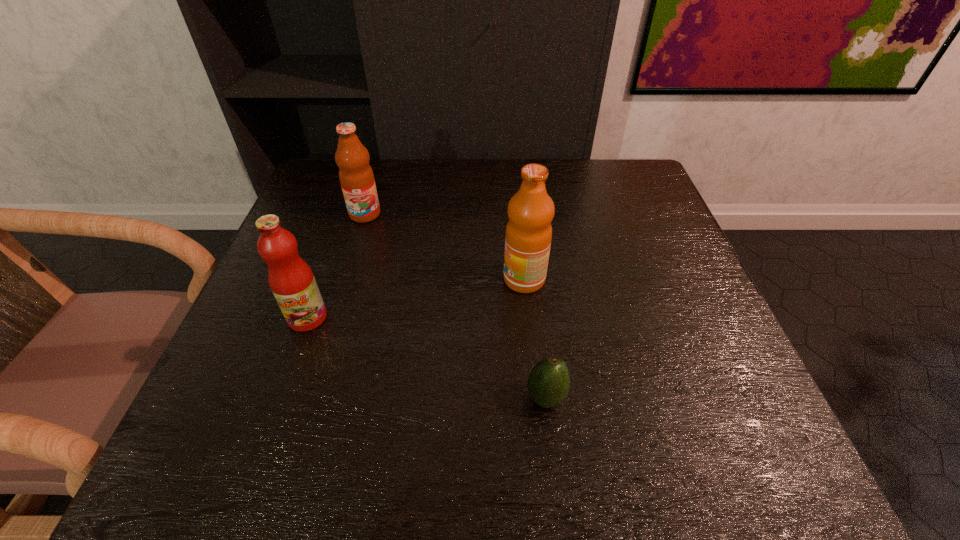
Identify the location of free region located 0.220m on the front label of the farthest fruit juice. The width and height of the screenshot is (960, 540). (343, 288).

The height and width of the screenshot is (540, 960). What are the coordinates of `free region located 0.220m on the right of the avocado` in the screenshot? It's located at (694, 397).

The height and width of the screenshot is (540, 960). In order to click on object present at the far edge in this screenshot , I will do `click(356, 176)`.

You are a GUI agent. You are given a task and a screenshot of the screen. Output one action in this format:
    pyautogui.click(x=<x>, y=<y>)
    Task: Click on the object at the far left corner
    Image resolution: width=960 pixels, height=540 pixels.
    Given the screenshot: What is the action you would take?
    pyautogui.click(x=356, y=176)

Identify the location of blank space at the far edge of the desktop. This screenshot has height=540, width=960. (502, 177).

Image resolution: width=960 pixels, height=540 pixels. Identify the location of free space at the near edge of the desktop. (625, 476).

The image size is (960, 540). In the image, there is a desktop. Find the location of `vacant space at the left edge`. vacant space at the left edge is located at coordinates tap(326, 221).

Locate an element on the screen. vacant space at the right edge of the desktop is located at coordinates (669, 408).

This screenshot has height=540, width=960. I want to click on vacant point at the far right corner, so click(631, 180).

The image size is (960, 540). Find the location of `free space between the third farthest object and the avocado`. free space between the third farthest object and the avocado is located at coordinates (426, 357).